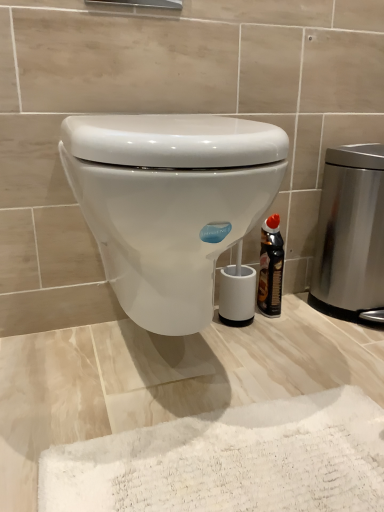
Question: Considering the relative positions of white glossy toilet at center and stainless steel trash can at right in the image provided, is white glossy toilet at center to the left of stainless steel trash can at right from the viewer's perspective?

Choices:
 (A) no
 (B) yes

Answer: (B)

Question: Does white glossy toilet at center have a lesser height compared to stainless steel trash can at right?

Choices:
 (A) yes
 (B) no

Answer: (A)

Question: Would you consider white glossy toilet at center to be distant from stainless steel trash can at right?

Choices:
 (A) yes
 (B) no

Answer: (B)

Question: Is white glossy toilet at center placed right next to stainless steel trash can at right?

Choices:
 (A) yes
 (B) no

Answer: (B)

Question: Can you confirm if white glossy toilet at center is taller than stainless steel trash can at right?

Choices:
 (A) no
 (B) yes

Answer: (A)

Question: Does white glossy toilet at center contain stainless steel trash can at right?

Choices:
 (A) no
 (B) yes

Answer: (A)

Question: Is stainless steel trash can at right shorter than white glossy toilet at center?

Choices:
 (A) yes
 (B) no

Answer: (B)

Question: Is stainless steel trash can at right thinner than white glossy toilet at center?

Choices:
 (A) no
 (B) yes

Answer: (B)

Question: From the image's perspective, does stainless steel trash can at right appear lower than white glossy toilet at center?

Choices:
 (A) yes
 (B) no

Answer: (B)

Question: From a real-world perspective, is stainless steel trash can at right below white glossy toilet at center?

Choices:
 (A) no
 (B) yes

Answer: (B)

Question: From the image's perspective, is stainless steel trash can at right above white glossy toilet at center?

Choices:
 (A) no
 (B) yes

Answer: (B)

Question: Is stainless steel trash can at right placed right next to white glossy toilet at center?

Choices:
 (A) no
 (B) yes

Answer: (A)

Question: From a real-world perspective, is black glossy bottle at right physically above white glossy toilet at center?

Choices:
 (A) yes
 (B) no

Answer: (B)